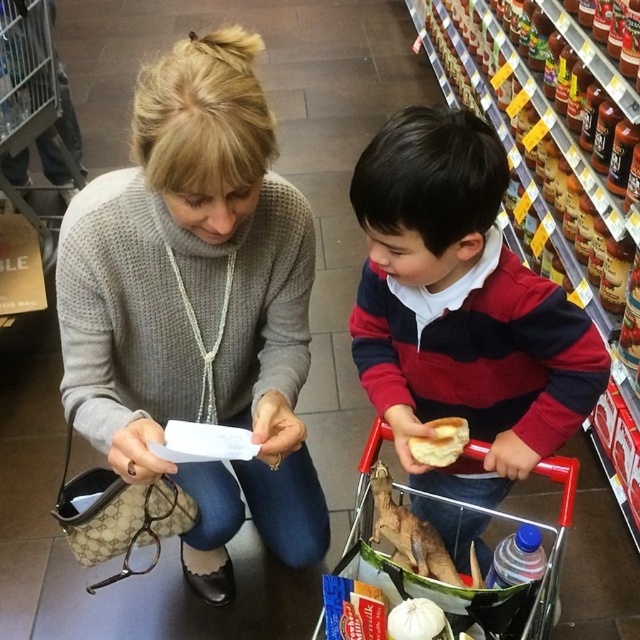
Measure the distance between metallic silver trolley at lower center and camera.

The distance of metallic silver trolley at lower center from camera is 6.32 feet.

Which is in front, point (10, 32) or point (422, 609)?

Point (422, 609)

The height and width of the screenshot is (640, 640). What do you see at coordinates (35, 108) in the screenshot?
I see `metallic silver trolley at lower center` at bounding box center [35, 108].

Find the location of a particular element. The width and height of the screenshot is (640, 640). metallic silver trolley at lower center is located at coordinates (35, 108).

Can you confirm if knit sweater at center is positioned below golden crispy bread at lower center?

Incorrect, knit sweater at center is not positioned below golden crispy bread at lower center.

Does point (160, 403) come farther from viewer compared to point (428, 458)?

Yes, point (160, 403) is behind point (428, 458).

At what (x,y) coordinates should I click in order to perform the action: click on knit sweater at center. Please return your answer as a coordinate pair (x, y). The image size is (640, 640). Looking at the image, I should click on (196, 305).

Can you confirm if golden crispy bread at lower center is positioned to the right of white matte garlic at lower center?

Yes, golden crispy bread at lower center is to the right of white matte garlic at lower center.

The image size is (640, 640). I want to click on golden crispy bread at lower center, so click(x=440, y=442).

At what (x,y) coordinates should I click in order to perform the action: click on golden crispy bread at lower center. Please return your answer as a coordinate pair (x, y). The image size is (640, 640). Looking at the image, I should click on (440, 442).

Locate an element on the screen. The image size is (640, 640). golden crispy bread at lower center is located at coordinates (440, 442).